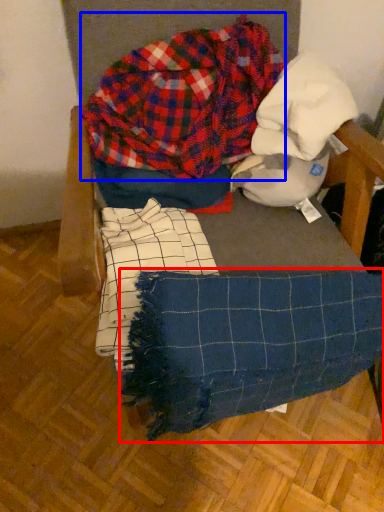
Question: Which object appears farthest to the camera in this image, blanket (highlighted by a red box) or flannel (highlighted by a blue box)?

Choices:
 (A) blanket
 (B) flannel

Answer: (B)